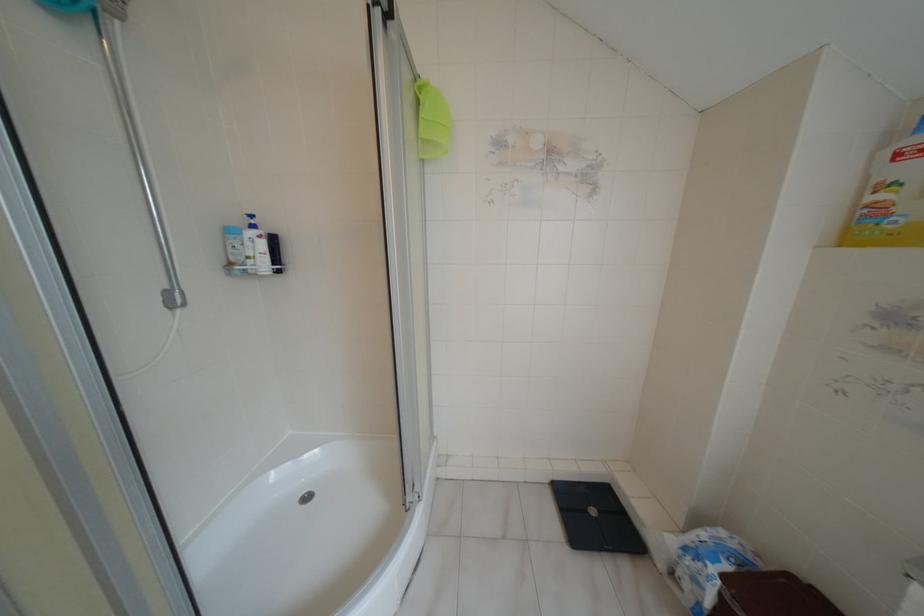
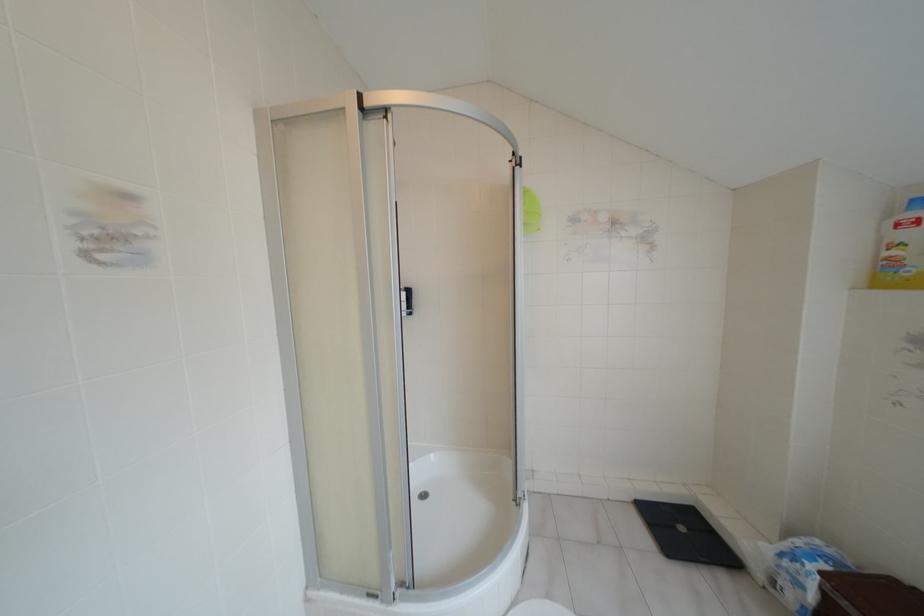
The point at (273,240) is marked in the first image. Where is the corresponding point in the second image?

(407, 292)